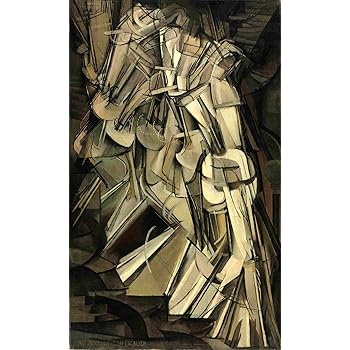
Locate an element on the screen. This screenshot has width=350, height=350. painting is located at coordinates (174, 156).